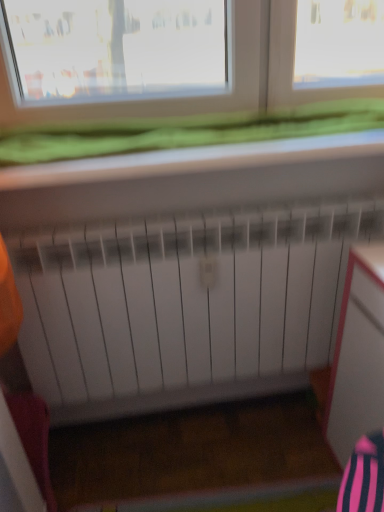
Locate an element on the screen. free spot above white matte radiator at center (from a real-world perspective) is located at coordinates (206, 218).